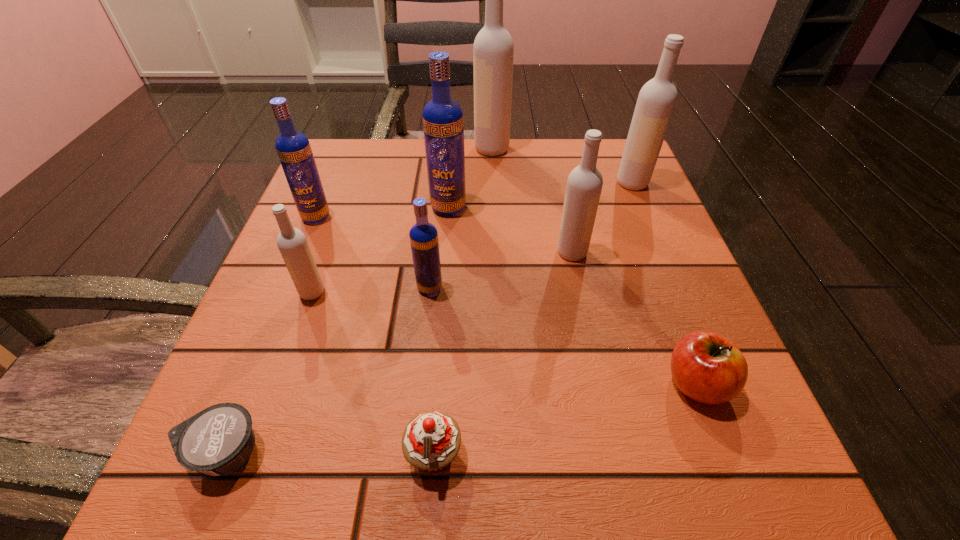
The width and height of the screenshot is (960, 540). I want to click on vacant point that satisfies the following two spatial constraints: 1. on the front side of the fifth farthest object; 2. on the left side of the apple, so click(x=599, y=383).